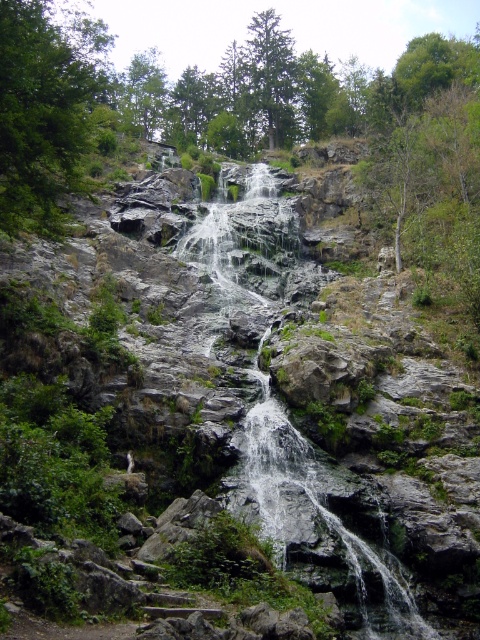
Question: Can you confirm if green matte tree at upper center is positioned to the right of green leafy tree at upper center?

Choices:
 (A) yes
 (B) no

Answer: (A)

Question: Where is gray stone waterfall at center located in relation to green leafy tree at upper center in the image?

Choices:
 (A) below
 (B) above

Answer: (A)

Question: Is green matte tree at upper center wider than green leafy tree at upper center?

Choices:
 (A) no
 (B) yes

Answer: (A)

Question: Among these points, which one is farthest from the camera?

Choices:
 (A) [60, 74]
 (B) [289, 80]
 (C) [251, 257]
 (D) [160, 86]

Answer: (B)

Question: Which object appears closest to the camera in this image?

Choices:
 (A) green leafy tree at upper left
 (B) gray stone waterfall at center
 (C) green matte tree at upper center
 (D) green leafy tree at upper center

Answer: (B)

Question: Among these points, which one is farthest from the camera?

Choices:
 (A) (311, 458)
 (B) (69, 96)
 (C) (264, 109)
 (D) (155, 96)

Answer: (C)